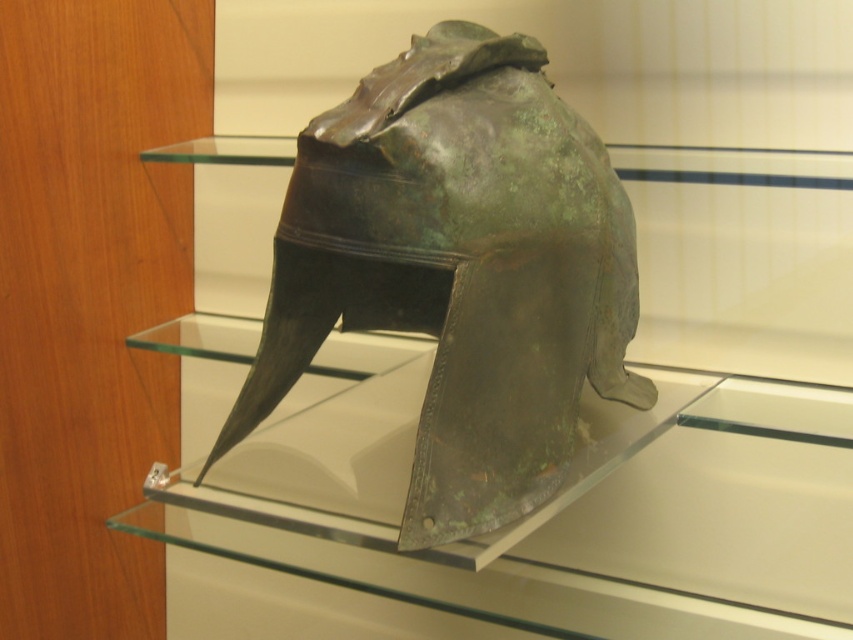
Question: Which point appears farthest from the camera in this image?

Choices:
 (A) (509, 250)
 (B) (782, 477)

Answer: (B)

Question: Does transparent glass helmet at center appear over green patina helmet at center?

Choices:
 (A) no
 (B) yes

Answer: (A)

Question: Is transparent glass helmet at center to the right of green patina helmet at center from the viewer's perspective?

Choices:
 (A) yes
 (B) no

Answer: (B)

Question: Among these points, which one is nearest to the camera?

Choices:
 (A) pyautogui.click(x=370, y=243)
 (B) pyautogui.click(x=759, y=176)

Answer: (A)

Question: In this image, where is transparent glass helmet at center located relative to green patina helmet at center?

Choices:
 (A) below
 (B) above

Answer: (A)